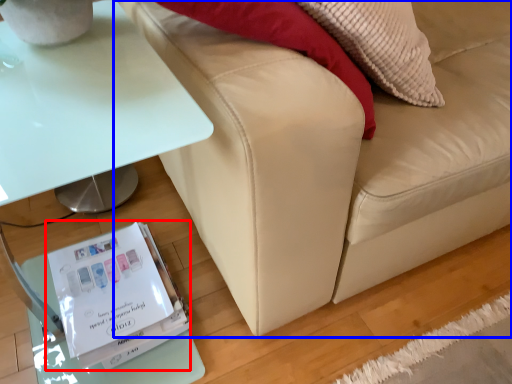
Question: Which point is closer to the camera, paperback book (highlighted by a red box) or studio couch (highlighted by a blue box)?

Choices:
 (A) paperback book
 (B) studio couch

Answer: (B)